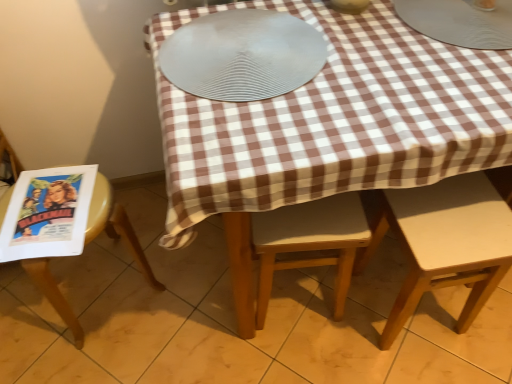
Locate an element on the screen. vacant area situated to the left side of yellow plastic chair at left, marked as the 3th chair in a right-to-left arrangement is located at coordinates (26, 310).